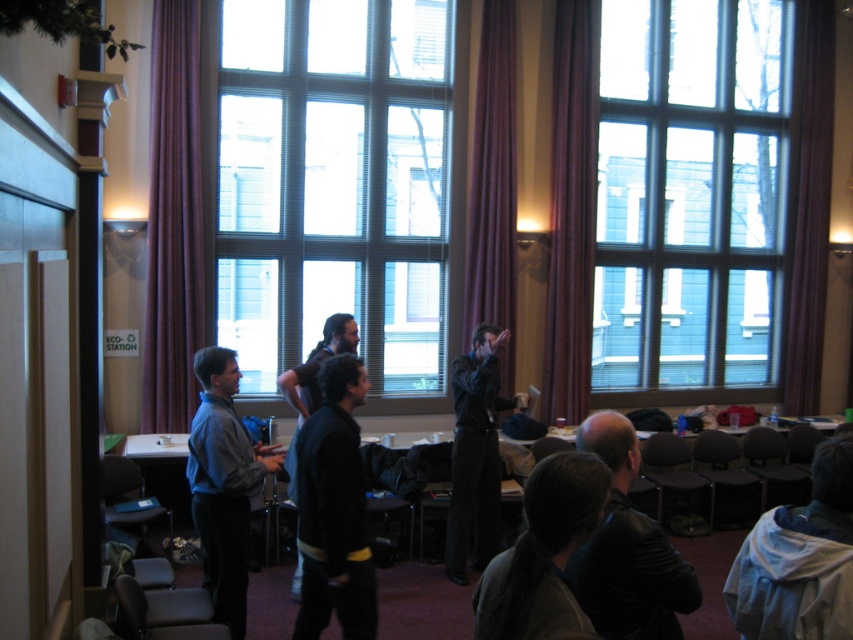
Question: Estimate the real-world distances between objects in this image. Which object is closer to the dark gray jacket at lower center?

Choices:
 (A) purple fabric curtain at right
 (B) dark blue shirt at center

Answer: (B)

Question: Considering the real-world distances, which object is farthest from the clear glass window at center?

Choices:
 (A) purple fabric curtain at left
 (B) purple fabric curtain at right
 (C) dark blue sweater at center

Answer: (C)

Question: Is black leather jacket at lower right positioned before blue shirt at center?

Choices:
 (A) yes
 (B) no

Answer: (A)

Question: Can you confirm if clear glass window at center is bigger than purple velvet curtain at right?

Choices:
 (A) no
 (B) yes

Answer: (B)

Question: Which of these objects is positioned farthest from the clear glass window at upper right?

Choices:
 (A) dark blue shirt at center
 (B) blue shirt at center
 (C) dark gray jacket at lower center

Answer: (C)

Question: Is purple fabric curtain at right smaller than blue shirt at center?

Choices:
 (A) yes
 (B) no

Answer: (A)